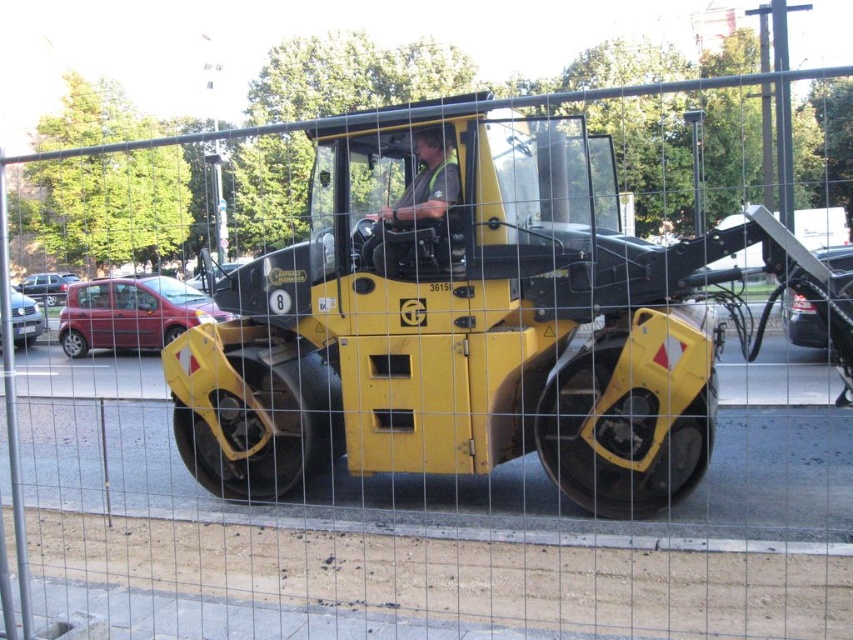
You are a delivery driver trying to park your truck behind the metal fence where the yellow matte compactor at center and the green fabric construction worker at center are located. The truck requires a parking spot that is wider than the space between these two objects. Can you determine if the space between them is wide enough for your truck?

The yellow matte compactor at center is positioned on the right side of green fabric construction worker at center, but the exact width of the space between them is not provided. Without knowing the truck width or the space width, it is impossible to determine if it is wide enough.

You are a delivery driver trying to park your truck next to the yellow matte compactor at center and the green fabric construction worker at center. Which object should you avoid to ensure your truck has enough space?

You should avoid the yellow matte compactor at center because its width is larger than the green fabric construction worker at center, so it requires more space.